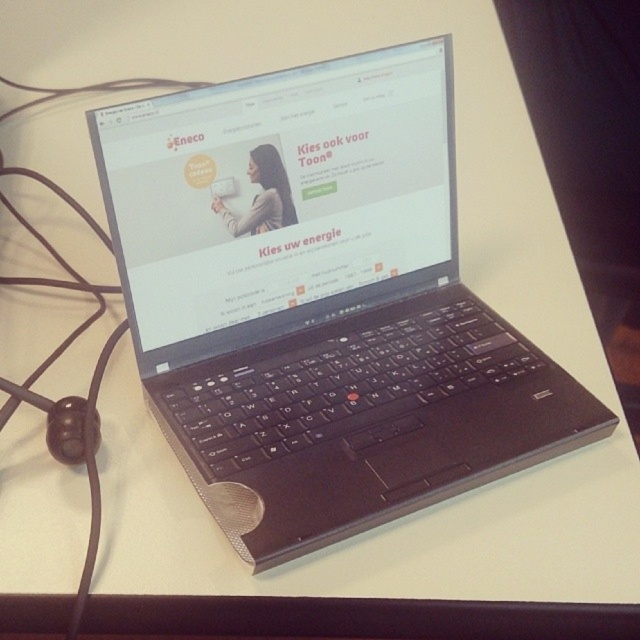
You are a delivery person who just arrived at a house to deliver a package. You see a black plastic laptop at center and a matte plastic woman at center on the desk. Which object is taller?

The black plastic laptop at center is taller than the matte plastic woman at center.

You are a delivery person who needs to place a small package on the laptop screen without covering the matte plastic woman at center and the white matte text at center. What is the minimum width the package should have to fit between them?

The minimum width the package should have to fit between the matte plastic woman at center and the white matte text at center is 2.15 inches, as they are 2.15 inches apart.

You are looking at the laptop screen showing the Eneco webpage. There is a matte plastic woman at center and white matte text at center. Which object is closer to you?

The matte plastic woman at center is closer to the viewer than the white matte text at center.